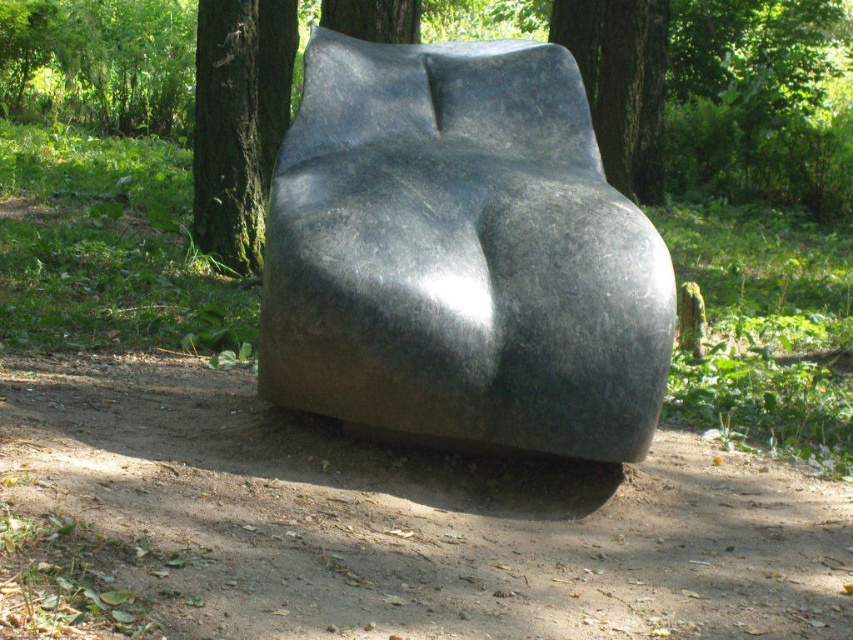
Is point (296, 161) behind point (624, 141)?

No.

Can you confirm if glossy black sculpture at center is wider than smooth bark tree at upper center?

Yes, glossy black sculpture at center is wider than smooth bark tree at upper center.

Find the location of a particular element. This screenshot has width=853, height=640. glossy black sculpture at center is located at coordinates (460, 253).

In the scene shown: How far apart are green mossy bark tree at center and smooth bark tree at upper center?

The distance of green mossy bark tree at center from smooth bark tree at upper center is 13.96 feet.

Does green mossy bark tree at center have a larger size compared to smooth bark tree at upper center?

Indeed, green mossy bark tree at center has a larger size compared to smooth bark tree at upper center.

Does point (235, 218) come behind point (625, 35)?

No, (235, 218) is closer to viewer.

Image resolution: width=853 pixels, height=640 pixels. I want to click on green mossy bark tree at center, so click(238, 120).

Does glossy black sculpture at center lie in front of green mossy bark tree at center?

Yes, it is in front of green mossy bark tree at center.

Is the position of glossy black sculpture at center more distant than that of green mossy bark tree at center?

No, glossy black sculpture at center is closer to the viewer.

Does point (479, 385) lie behind point (265, 145)?

No.

Locate an element on the screen. The height and width of the screenshot is (640, 853). glossy black sculpture at center is located at coordinates (460, 253).